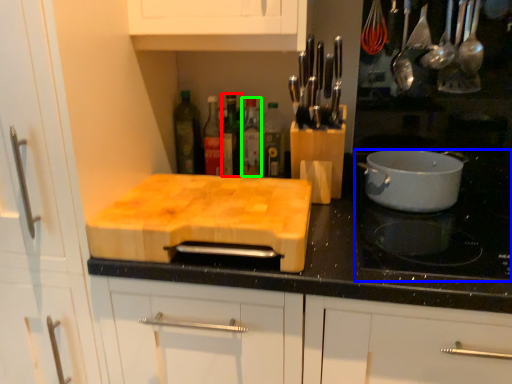
Question: Estimate the real-world distances between objects in this image. Which object is closer to bottle (highlighted by a red box), gas stove (highlighted by a blue box) or bottle (highlighted by a green box)?

Choices:
 (A) gas stove
 (B) bottle

Answer: (B)